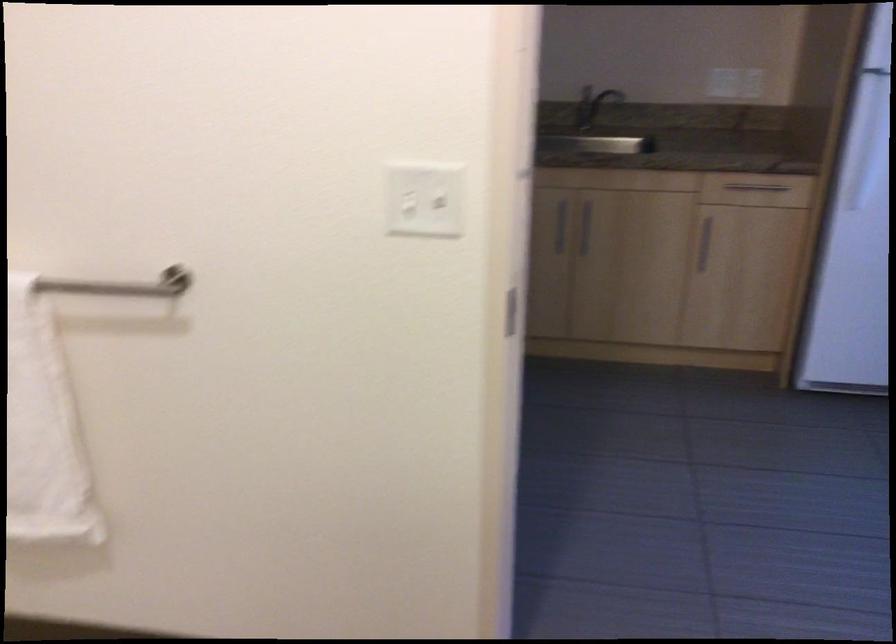
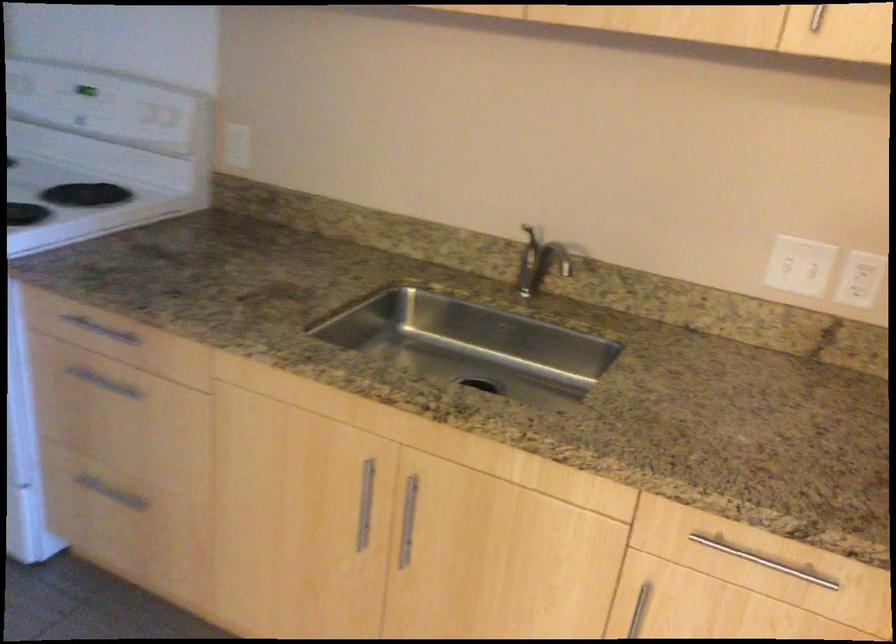
In the second image, find the point that corresponds to the point at 711,78 in the first image.

(798, 266)